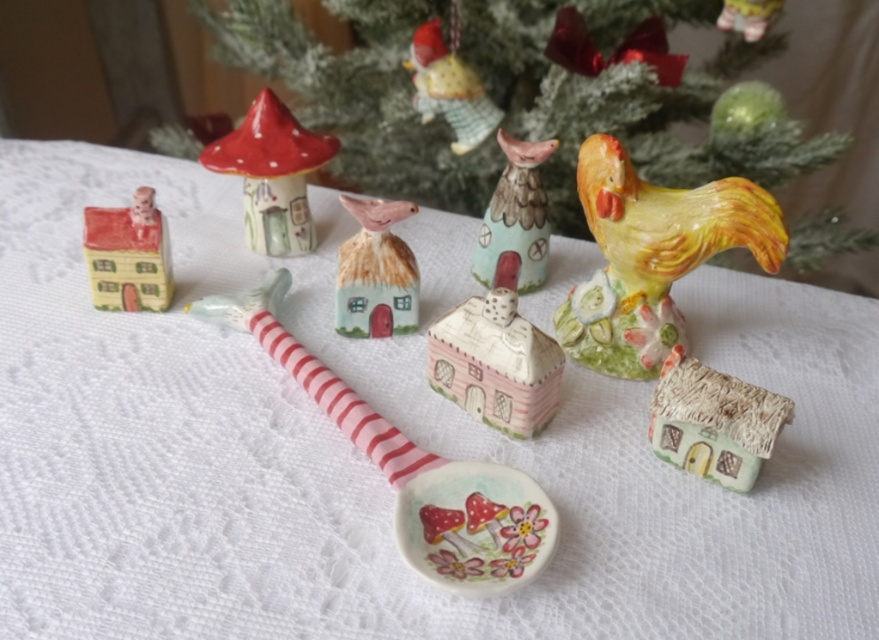
You are a collector of miniature houses and are standing at the edge of the table where the matte green house at lower right is displayed. You want to place a new miniature garden gnome exactly 4 feet away from the house. Is the table large enough to accommodate this placement?

The matte green house at lower right and the viewer are 3.65 feet apart. Since the gnome needs to be placed 4 feet away from the house, the table might not be large enough as the current distance from the viewer to the house is already 3.65 feet, leaving insufficient space for an additional 4 feet.